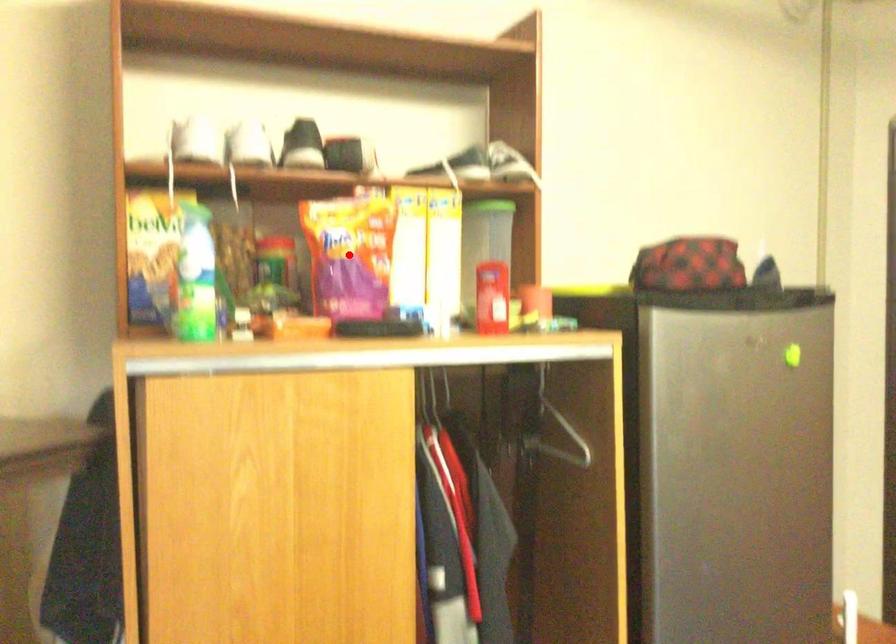
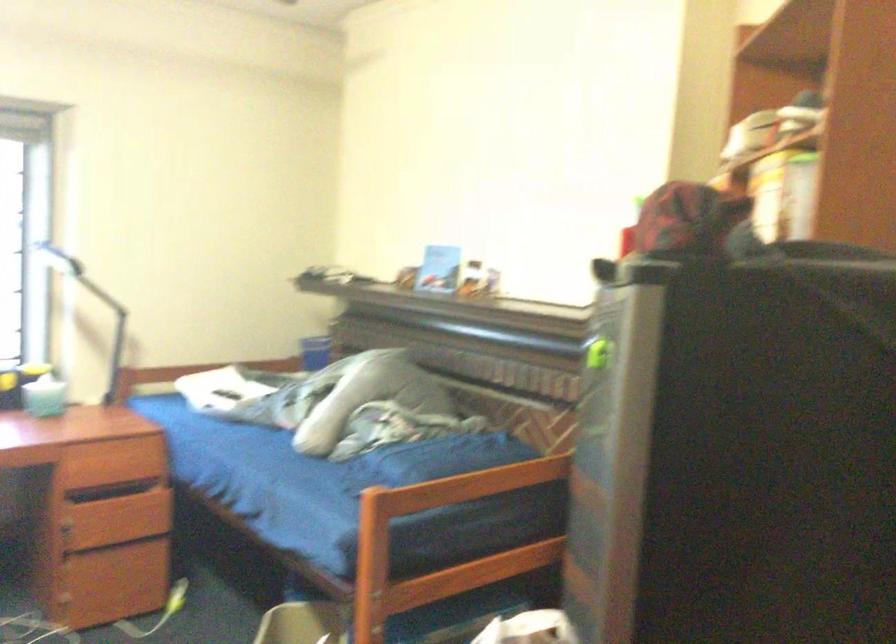
Question: I am providing you with two images of the same scene from different viewpoints. A red point is marked on the first image. Can you still see the location of the red point in image 2?

Choices:
 (A) Yes
 (B) No

Answer: (B)